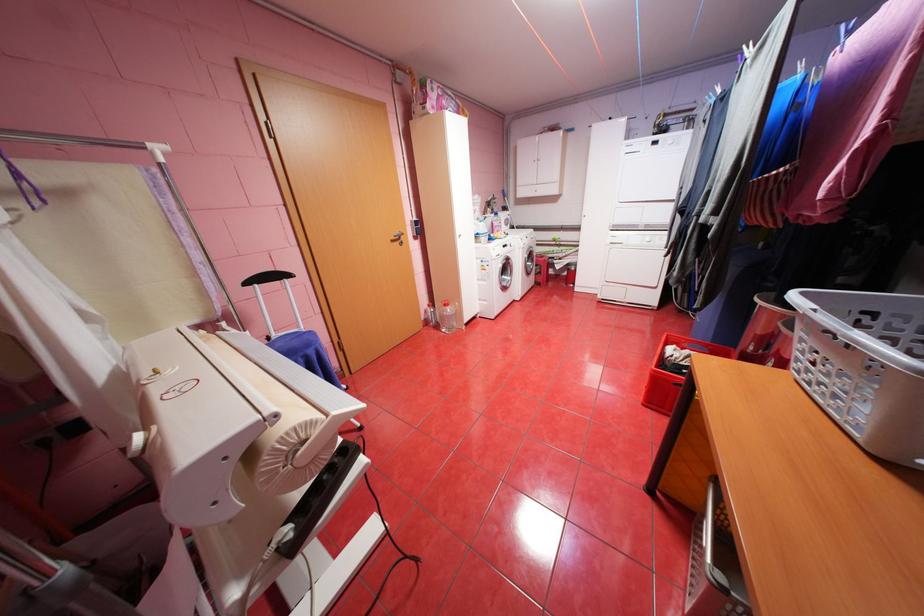
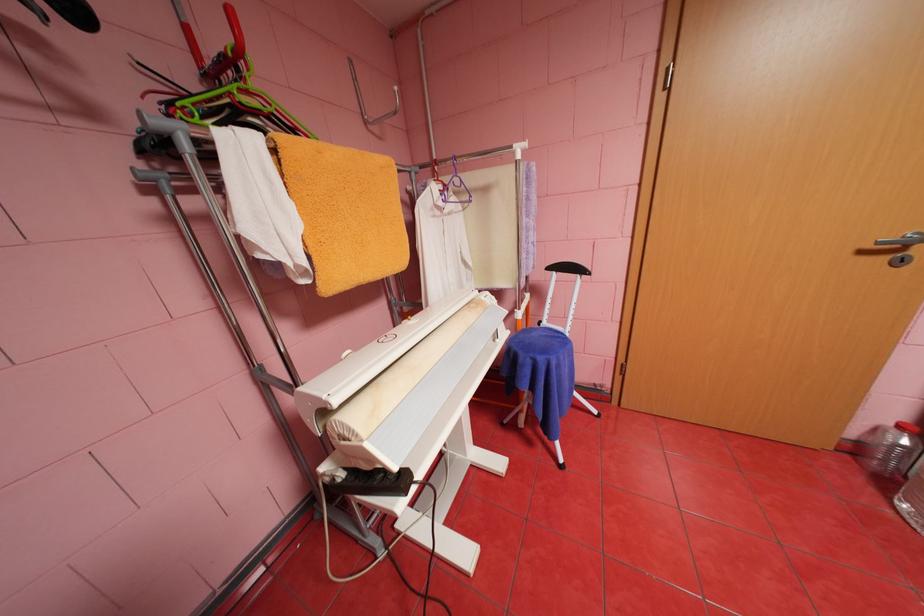
Based on the photo, based on the continuous images, in which direction is the camera rotating?

The camera's rotation is toward left-down.